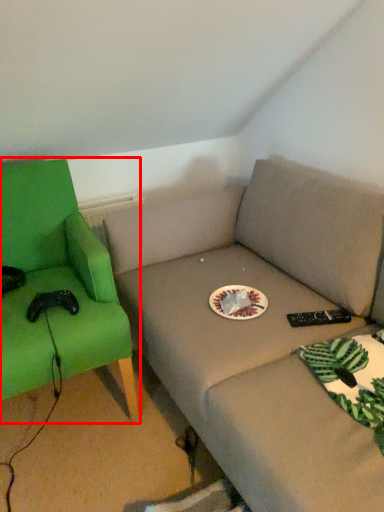
Question: From the image's perspective, what is the correct spatial positioning of chair (annotated by the red box) in reference to paper plate?

Choices:
 (A) above
 (B) below

Answer: (B)